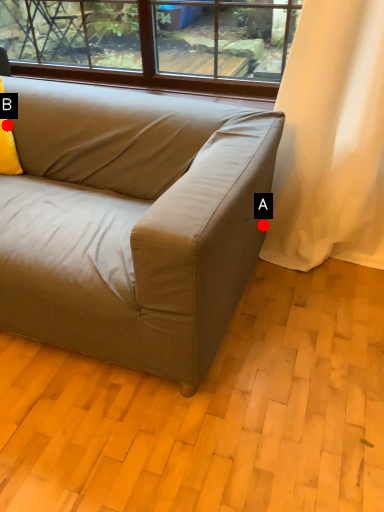
Question: Two points are circled on the image, labeled by A and B beside each circle. Which point is farther to the camera?

Choices:
 (A) A is further
 (B) B is further

Answer: (A)